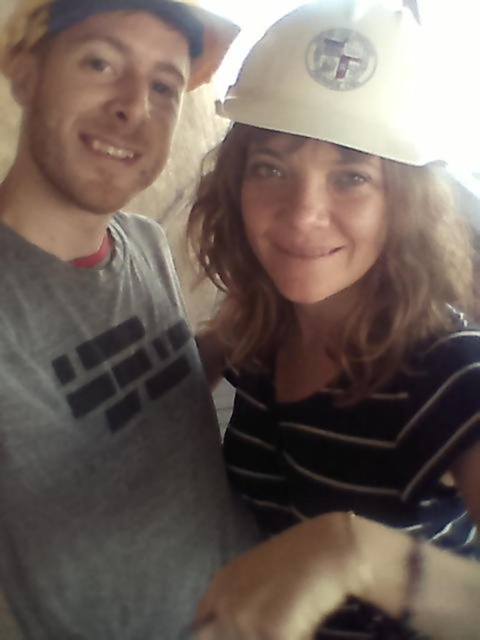
Where is `gray matte t-shirt at left`? This screenshot has height=640, width=480. gray matte t-shirt at left is located at coordinates (103, 332).

Does point (39, 596) come closer to viewer compared to point (232, 108)?

No.

Where is `gray matte t-shirt at left`? The width and height of the screenshot is (480, 640). gray matte t-shirt at left is located at coordinates 103,332.

Is white matte hard hat at upper right wider than gray matte t-shirt at left?

Correct, the width of white matte hard hat at upper right exceeds that of gray matte t-shirt at left.

Is white matte hard hat at upper right above gray matte t-shirt at left?

Incorrect, white matte hard hat at upper right is not positioned above gray matte t-shirt at left.

Who is more forward, [410,477] or [109,378]?

Positioned in front is point [410,477].

I want to click on white matte hard hat at upper right, so click(343, 337).

Is white matte hard hat at upper right smaller than white matte hard hat at upper center?

Actually, white matte hard hat at upper right might be larger than white matte hard hat at upper center.

Is point (434, 241) less distant than point (324, 70)?

No, it is not.

Is point (431, 547) positioned after point (280, 56)?

That is False.

I want to click on white matte hard hat at upper right, so click(x=343, y=337).